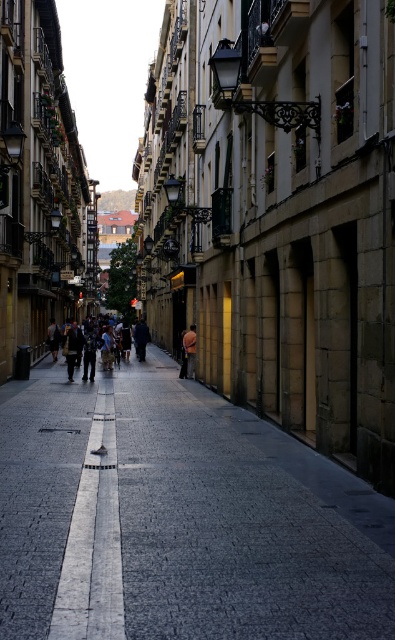
Question: Can you confirm if dark gray cobblestone at center is smaller than orange fabric bag at center?

Choices:
 (A) no
 (B) yes

Answer: (A)

Question: Estimate the real-world distances between objects in this image. Which object is farther from the dark gray cobblestone at center?

Choices:
 (A) dark blue jeans at center
 (B) orange fabric bag at center

Answer: (A)

Question: Estimate the real-world distances between objects in this image. Which object is farther from the dark blue jeans at center?

Choices:
 (A) dark gray cobblestone at center
 (B) orange fabric bag at center

Answer: (A)

Question: Is dark blue jeans at center closer to camera compared to orange fabric bag at center?

Choices:
 (A) no
 (B) yes

Answer: (B)

Question: Which point is farther from the camera taking this photo?

Choices:
 (A) (77, 340)
 (B) (193, 346)

Answer: (B)

Question: From the image, what is the correct spatial relationship of dark blue jeans at center in relation to orange fabric bag at center?

Choices:
 (A) left
 (B) right

Answer: (A)